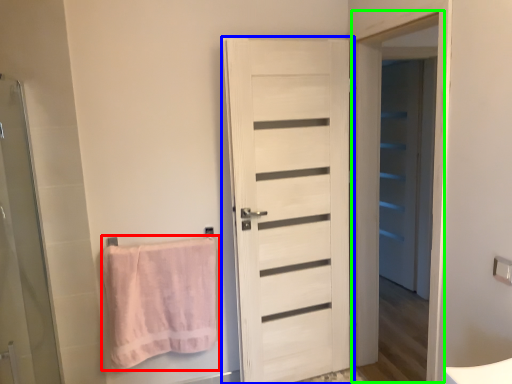
Question: Considering the real-world distances, which object is closest to towel (highlighted by a red box)? door (highlighted by a blue box) or screen door (highlighted by a green box).

Choices:
 (A) door
 (B) screen door

Answer: (A)